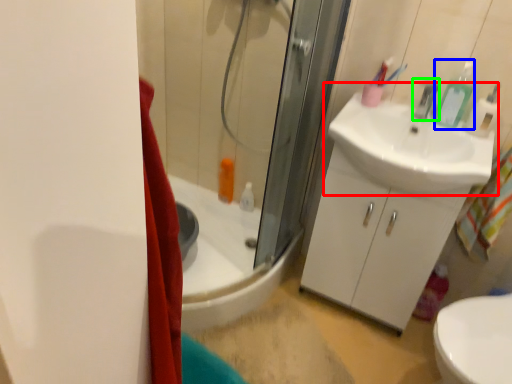
Question: Considering the real-world distances, which object is farthest from sink (highlighted by a red box)? toiletry (highlighted by a blue box) or faucet (highlighted by a green box)?

Choices:
 (A) toiletry
 (B) faucet

Answer: (B)